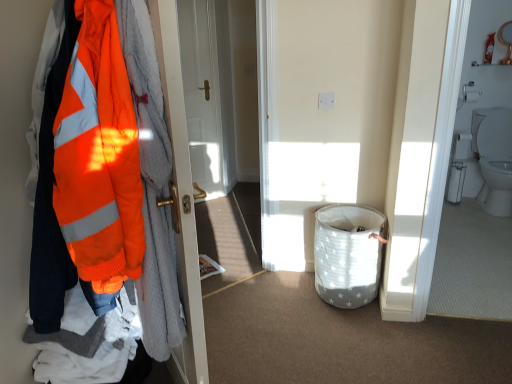
Question: Looking at their shapes, would you say white fabric laundry basket at lower center is wider or thinner than high-visibility orange jacket at left?

Choices:
 (A) wide
 (B) thin

Answer: (B)

Question: Is point (320, 271) closer or farther from the camera than point (159, 147)?

Choices:
 (A) closer
 (B) farther

Answer: (B)

Question: Estimate the real-world distances between objects in this image. Which object is closer to the white fabric laundry basket at lower center?

Choices:
 (A) white glossy toilet at right
 (B) high-visibility orange jacket at left
 (C) white glossy door at center
 (D) white glossy toilet at right

Answer: (A)

Question: Estimate the real-world distances between objects in this image. Which object is closer to the white glossy door at center?

Choices:
 (A) white fabric laundry basket at lower center
 (B) white glossy toilet at right
 (C) white glossy toilet at right
 (D) high-visibility orange jacket at left

Answer: (A)